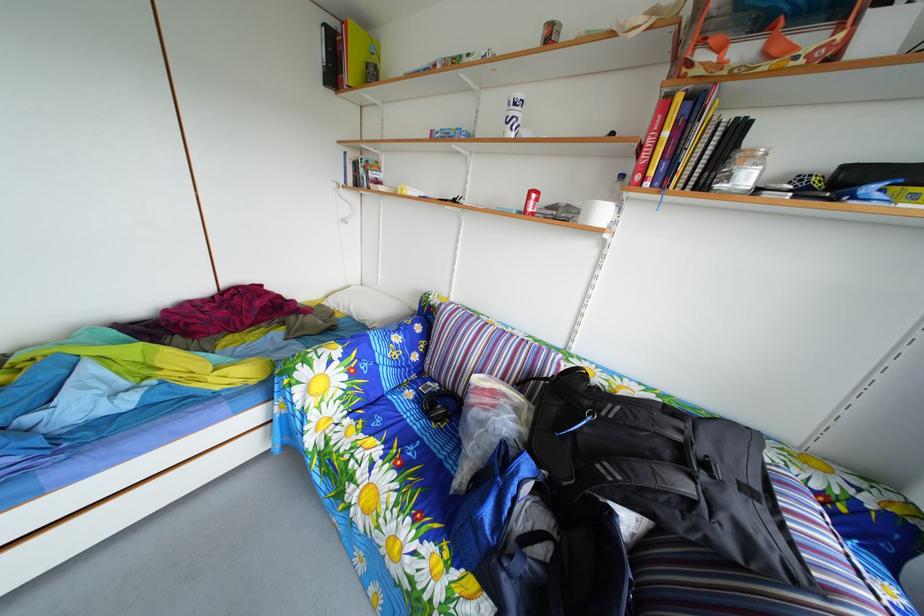
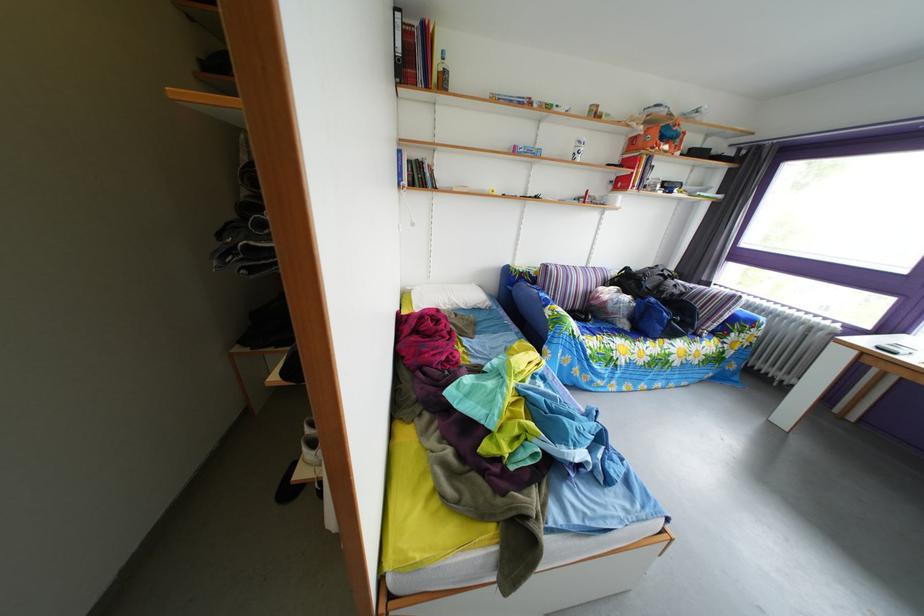
In the second image, find the point that corresponds to [772,33] in the first image.

(673, 147)